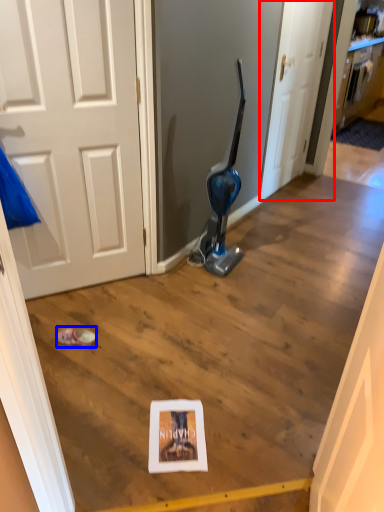
Question: Which object is further to the camera taking this photo, door (highlighted by a red box) or footwear (highlighted by a blue box)?

Choices:
 (A) door
 (B) footwear

Answer: (A)